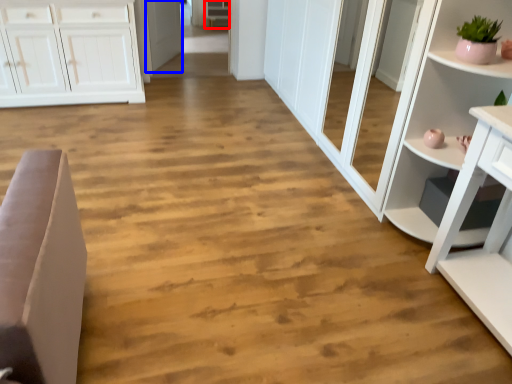
Question: Which point is further to the camera, cabinetry (highlighted by a red box) or door (highlighted by a blue box)?

Choices:
 (A) cabinetry
 (B) door

Answer: (A)